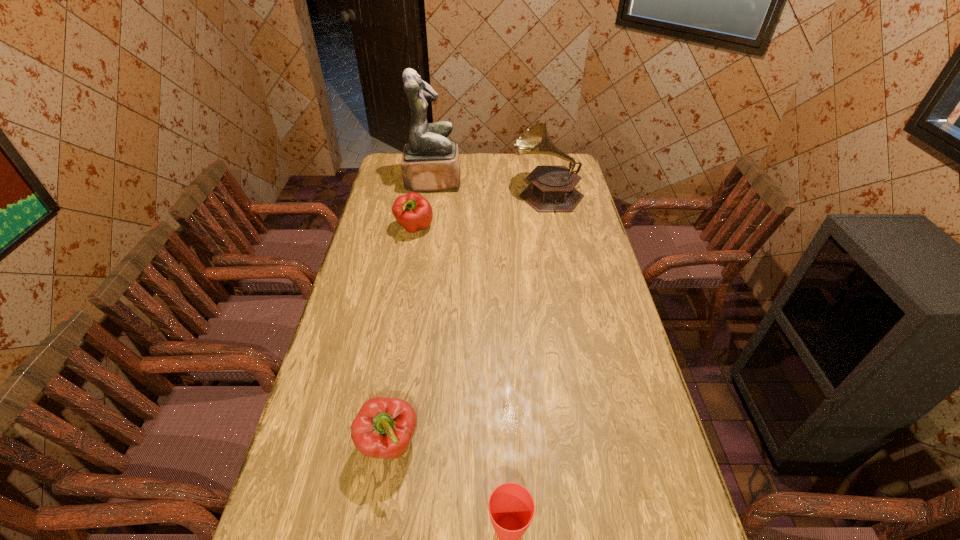
I want to click on free point located 0.250m on the front of the third farthest object, so click(x=404, y=285).

Where is `sculpture that is at the far edge`? Image resolution: width=960 pixels, height=540 pixels. sculpture that is at the far edge is located at coordinates (430, 162).

This screenshot has height=540, width=960. Identify the location of phonograph record at the far edge. (551, 189).

The height and width of the screenshot is (540, 960). Identify the location of sculpture that is at the left edge. (430, 162).

Where is `object situated at the right edge`? This screenshot has height=540, width=960. object situated at the right edge is located at coordinates (551, 189).

This screenshot has width=960, height=540. Find the location of `object located at the far left corner`. object located at the far left corner is located at coordinates (430, 162).

Find the location of a particular element. object at the far right corner is located at coordinates (551, 189).

Locate an element on the screen. Image resolution: width=960 pixels, height=540 pixels. blank area at the far edge is located at coordinates (532, 162).

I want to click on free location at the left edge of the desktop, so click(x=377, y=336).

Find the location of a particular element. vacant space at the right edge of the desktop is located at coordinates [x=636, y=381].